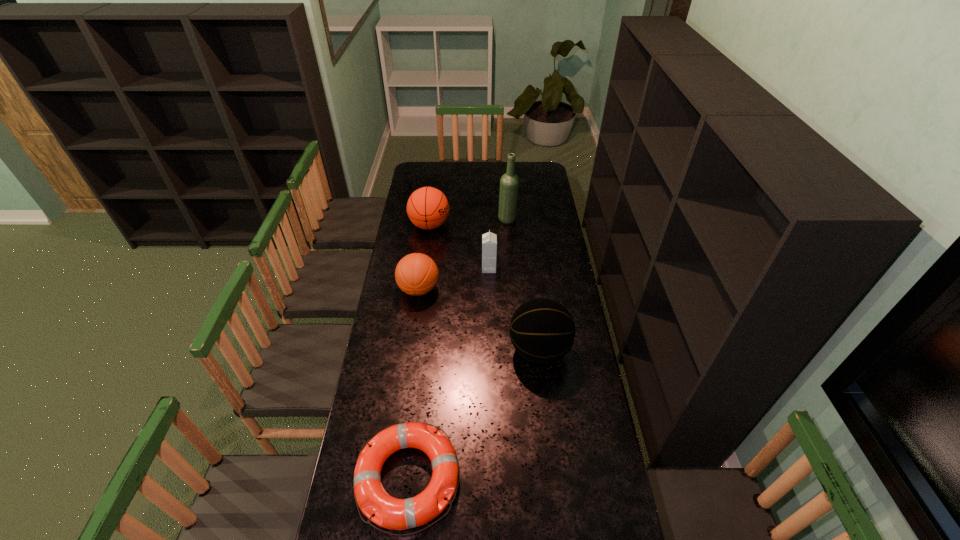
Find the location of a particular element. vacant space that is in between the rightmost basketball and the shortest object is located at coordinates (473, 414).

Where is `free space between the second nearest object and the life buoy`? Image resolution: width=960 pixels, height=540 pixels. free space between the second nearest object and the life buoy is located at coordinates (473, 414).

I want to click on free space between the wine bottle and the farthest basketball, so click(468, 222).

Select which object is the closest to the nearest object. Please provide its 2D coordinates. Your answer should be formatted as a tuple, i.e. [(x, y)], where the tuple contains the x and y coordinates of a point satisfying the conditions above.

[(542, 331)]

Locate which object is the third closest to the carton. Please provide its 2D coordinates. Your answer should be formatted as a tuple, i.e. [(x, y)], where the tuple contains the x and y coordinates of a point satisfying the conditions above.

[(509, 183)]

Identify which basketball is located as the nearest to the second farthest basketball. Please provide its 2D coordinates. Your answer should be formatted as a tuple, i.e. [(x, y)], where the tuple contains the x and y coordinates of a point satisfying the conditions above.

[(428, 208)]

Locate which basketball is the second closest to the fourth nearest object. Please provide its 2D coordinates. Your answer should be formatted as a tuple, i.e. [(x, y)], where the tuple contains the x and y coordinates of a point satisfying the conditions above.

[(428, 208)]

The height and width of the screenshot is (540, 960). What are the coordinates of `vacant position in the image that satisfies the following two spatial constraints: 1. on the front label of the carton; 2. on the front side of the third nearest object` in the screenshot? It's located at (490, 289).

What are the coordinates of `free space that satisfies the following two spatial constraints: 1. on the side with logo of the farthest basketball; 2. on the left side of the life buoy` in the screenshot? It's located at (396, 478).

Identify the location of free point that satisfies the following two spatial constraints: 1. on the front label of the carton; 2. on the front side of the nearest object. Image resolution: width=960 pixels, height=540 pixels. (493, 478).